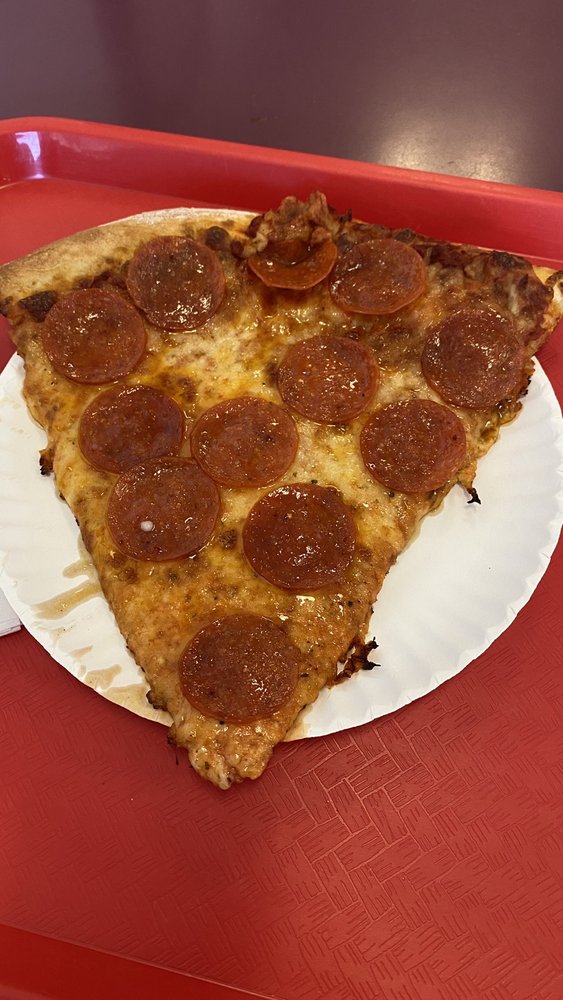
The height and width of the screenshot is (1000, 563). In order to click on tray in this screenshot , I will do `click(352, 869)`, `click(12, 766)`, `click(28, 214)`, `click(176, 166)`.